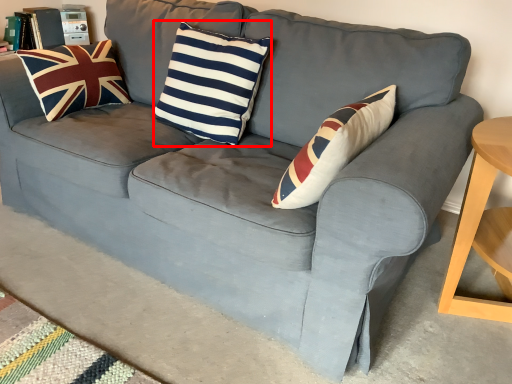
Question: From the image's perspective, what is the correct spatial positioning of pillow (annotated by the red box) in reference to pillow?

Choices:
 (A) below
 (B) above

Answer: (A)